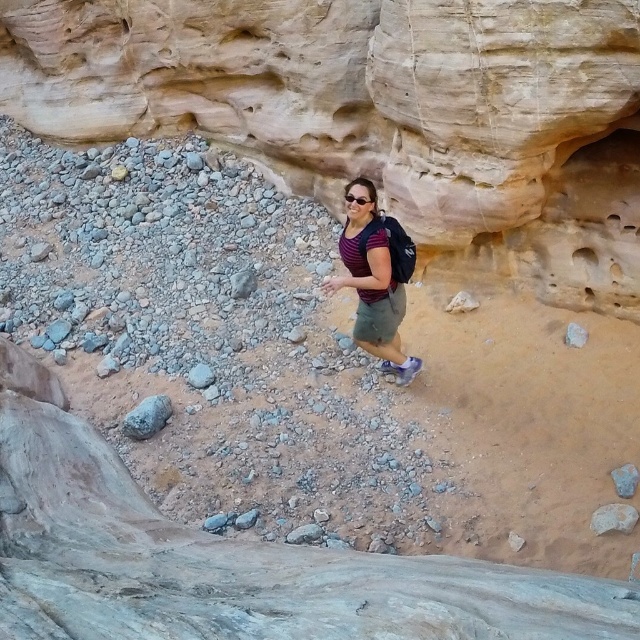
Question: Which point appears farthest from the camera in this image?

Choices:
 (A) (572, 292)
 (B) (374, 202)
 (C) (134, 433)
 (D) (356, 193)

Answer: (A)

Question: Is gray rough rock at lower left wider than clear plastic goggles at center?

Choices:
 (A) yes
 (B) no

Answer: (A)

Question: Is gray rough rock at lower left bigger than smooth sandstone rock at center-right?

Choices:
 (A) no
 (B) yes

Answer: (B)

Question: Which object is positioned farthest from the striped fabric shirt at center?

Choices:
 (A) smooth sandstone rock at center-right
 (B) gray rock at lower right

Answer: (B)

Question: Which object appears closest to the camera in this image?

Choices:
 (A) smooth sandstone cliff at center
 (B) smooth beige rock at lower right
 (C) gray rough rock at lower left

Answer: (B)

Question: Can you confirm if smooth beige rock at lower right is wider than smooth sandstone rock at center-right?

Choices:
 (A) yes
 (B) no

Answer: (A)